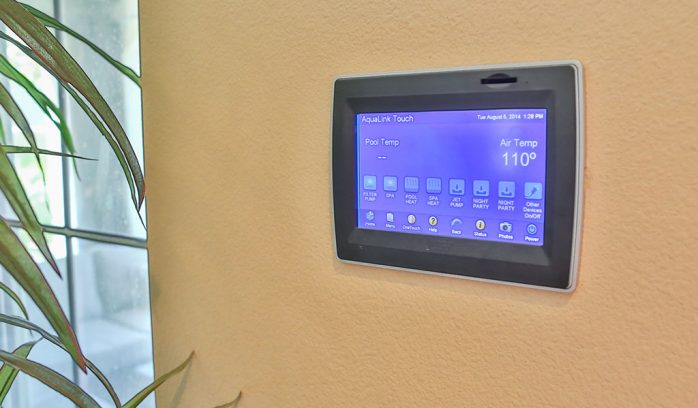
The width and height of the screenshot is (698, 408). Find the location of `window pane`. window pane is located at coordinates (56, 165), (102, 201), (54, 242), (107, 271).